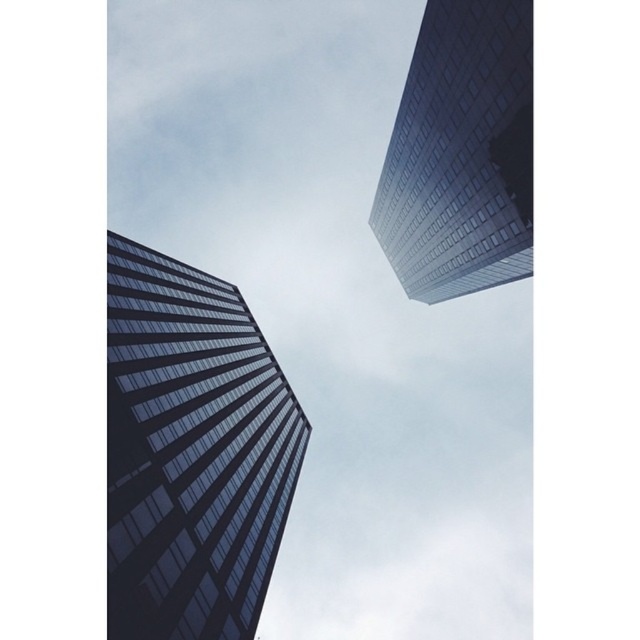
You are a drone operator who needs to fly a drone between the two glassy reflective skyscrapers. The drone has a wingspan of 10 feet. Based on the image, can the drone safely navigate the space between the glassy reflective skyscraper at center and the glassy reflective skyscraper at upper right?

The glassy reflective skyscraper at center and glassy reflective skyscraper at upper right are 115.85 feet apart from each other. Since the drone has a wingspan of 10 feet, there is more than enough space for it to safely navigate between them.

You are standing at the base of the skyscrapers and want to take a photo of the point at coordinates point [113,625]. If your camera has a maximum zoom range of 100 feet, will you be able to capture the point clearly in your photo?

The point [113,625] is 106.61 feet away from the viewer. Since the camera can only zoom up to 100 feet, it won not be able to capture the point clearly.